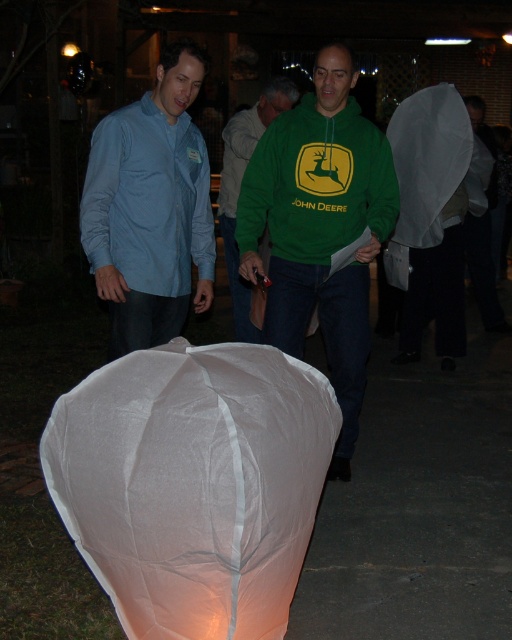
Question: Estimate the real-world distances between objects in this image. Which object is farther from the green fleece at center?

Choices:
 (A) green matte hoodie at center
 (B) white paper lantern at center
 (C) matte blue shirt at left
 (D) white paper bag at center

Answer: (D)

Question: Does green fleece at center have a greater width compared to matte blue shirt at left?

Choices:
 (A) yes
 (B) no

Answer: (A)

Question: Does white paper lantern at center have a greater width compared to green fleece at center?

Choices:
 (A) no
 (B) yes

Answer: (B)

Question: Does green fleece at center have a lesser width compared to matte blue shirt at left?

Choices:
 (A) no
 (B) yes

Answer: (A)

Question: Among these objects, which one is farthest from the camera?

Choices:
 (A) white paper lantern at center
 (B) white paper bag at center
 (C) green fleece at center

Answer: (B)

Question: Based on their relative distances, which object is nearer to the green matte hoodie at center?

Choices:
 (A) green fleece at center
 (B) white paper lantern at center
 (C) matte blue shirt at left
 (D) white paper bag at center

Answer: (D)